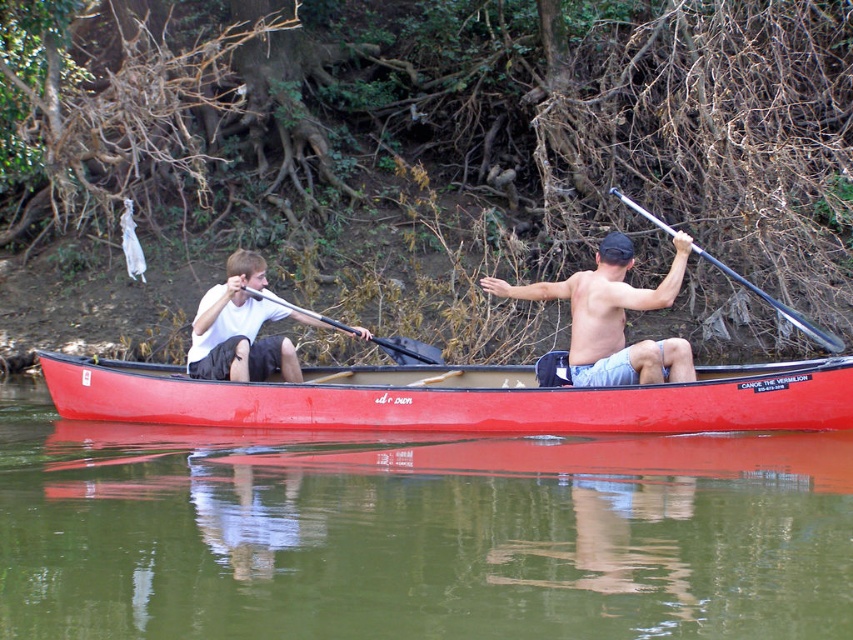
Question: Does green smooth water at center have a greater width compared to shiny blue shorts at center?

Choices:
 (A) yes
 (B) no

Answer: (B)

Question: Which point appears closest to the camera in this image?

Choices:
 (A) (122, 365)
 (B) (428, 362)
 (C) (225, 269)

Answer: (B)

Question: Which point is farther from the camera taking this photo?

Choices:
 (A) (144, 387)
 (B) (410, 349)
 (C) (714, 262)

Answer: (B)

Question: Is green smooth water at center smaller than matte red canoe at center?

Choices:
 (A) no
 (B) yes

Answer: (B)

Question: Which object is the closest to the green smooth water at center?

Choices:
 (A) matte red canoe at center
 (B) shiny blue shorts at center

Answer: (B)

Question: Considering the relative positions of matte white t-shirt at left and black rubber paddle at center in the image provided, where is matte white t-shirt at left located with respect to black rubber paddle at center?

Choices:
 (A) left
 (B) right

Answer: (A)